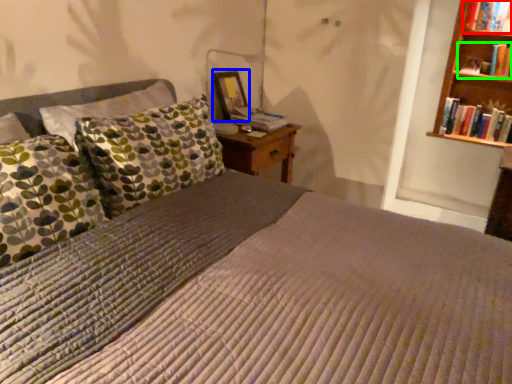
Question: Which object is the closest to the book (highlighted by a red box)? Choose among these: picture frame (highlighted by a blue box) or book (highlighted by a green box).

Choices:
 (A) picture frame
 (B) book

Answer: (B)